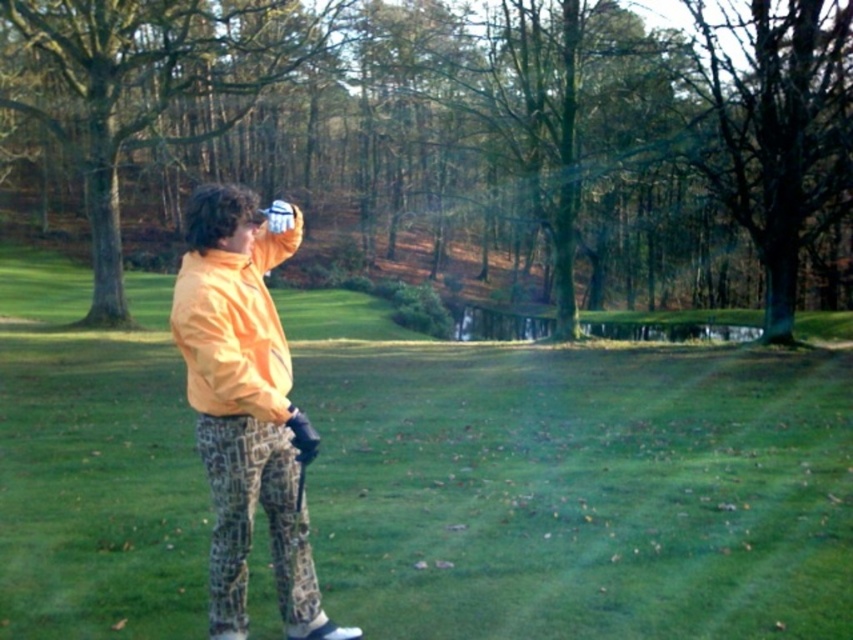
Question: Which object appears closest to the camera in this image?

Choices:
 (A) green leafy tree at center
 (B) green leafy tree at left
 (C) green grass at center

Answer: (C)

Question: Can you confirm if green grass at center is wider than green leafy tree at center?

Choices:
 (A) no
 (B) yes

Answer: (A)

Question: Which object appears closest to the camera in this image?

Choices:
 (A) green grass at center
 (B) orange fabric jacket at center

Answer: (B)

Question: Is green leafy tree at center to the right of orange fabric jacket at center from the viewer's perspective?

Choices:
 (A) no
 (B) yes

Answer: (A)

Question: Considering the real-world distances, which object is farthest from the green leafy tree at left?

Choices:
 (A) green grass at center
 (B) orange fabric jacket at center
 (C) green leafy tree at center

Answer: (B)

Question: From the image, what is the correct spatial relationship of green grass at center in relation to green leafy tree at left?

Choices:
 (A) above
 (B) below

Answer: (B)